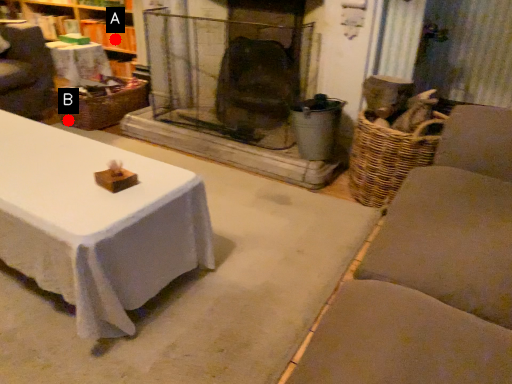
Question: Two points are circled on the image, labeled by A and B beside each circle. Which point is further to the camera?

Choices:
 (A) A is further
 (B) B is further

Answer: (A)